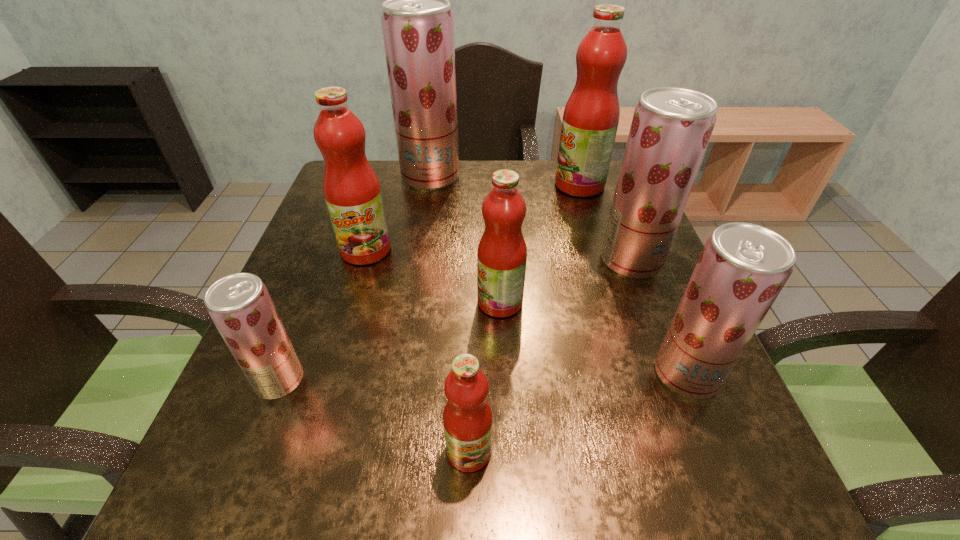
The width and height of the screenshot is (960, 540). I want to click on free region that satisfies the following two spatial constraints: 1. on the front label of the rightmost pink fruit juice; 2. on the front label of the smallest pink fruit juice, so click(662, 450).

This screenshot has width=960, height=540. Identify the location of free space that satisfies the following two spatial constraints: 1. on the back side of the smallest strawberry fruit juice; 2. on the left side of the second biggest strawberry fruit juice. (325, 260).

Locate an element on the screen. vacant space that satisfies the following two spatial constraints: 1. on the front label of the third biggest strawberry fruit juice; 2. on the left side of the second farthest pink fruit juice is located at coordinates (329, 374).

Find the location of `vacant region that satisfies the following two spatial constraints: 1. on the front label of the rightmost pink fruit juice; 2. on the front label of the nearest fruit juice`. vacant region that satisfies the following two spatial constraints: 1. on the front label of the rightmost pink fruit juice; 2. on the front label of the nearest fruit juice is located at coordinates (662, 450).